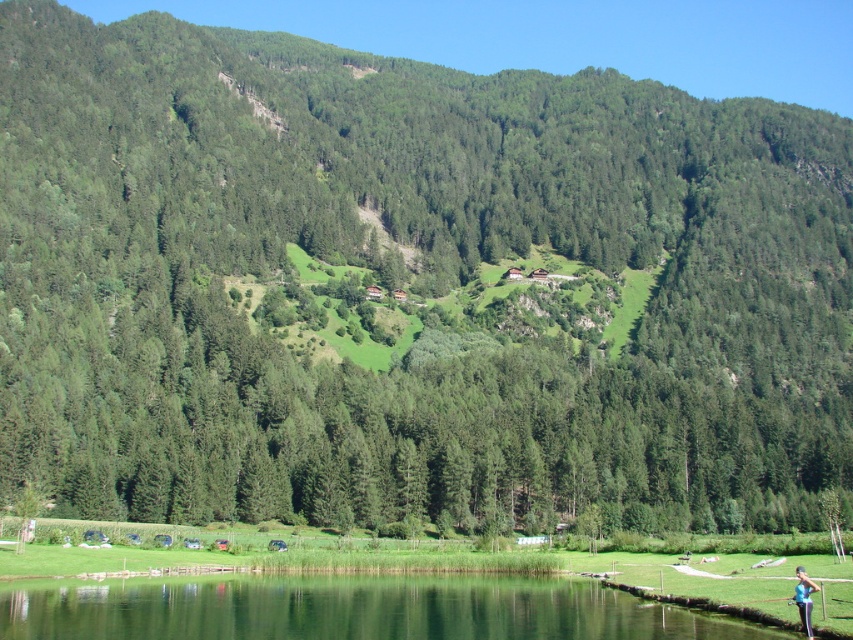
Does green smooth water at lower center lie behind blue fabric person at lower right?

No, green smooth water at lower center is in front of blue fabric person at lower right.

Locate an element on the screen. The image size is (853, 640). green smooth water at lower center is located at coordinates (349, 609).